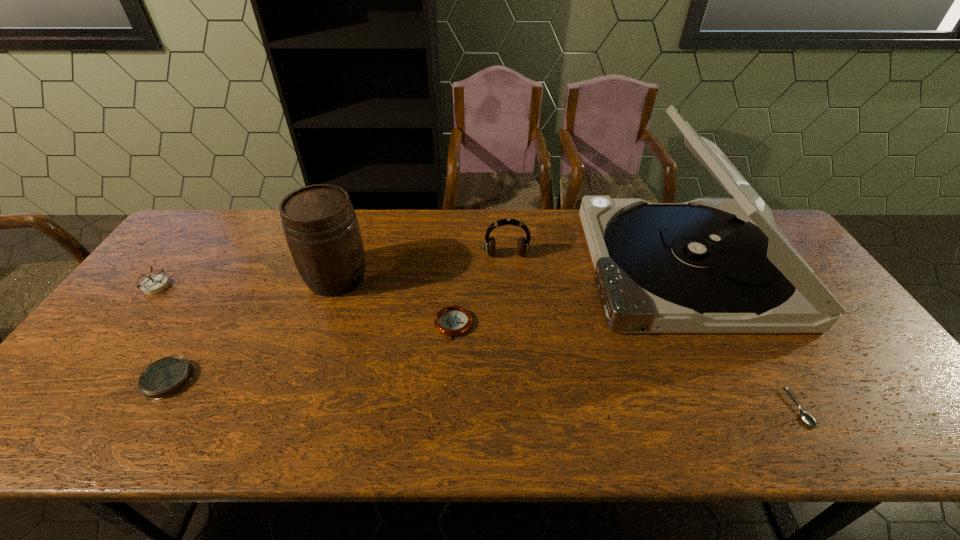
The width and height of the screenshot is (960, 540). In order to click on unoccupied area between the second object from left to right and the second farthest compass in this screenshot , I will do click(x=311, y=352).

Locate an element on the screen. object that is the fifth closest one to the tallest object is located at coordinates (167, 376).

Identify which object is the second closest to the soupspoon. Please provide its 2D coordinates. Your answer should be formatted as a tuple, i.e. [(x, y)], where the tuple contains the x and y coordinates of a point satisfying the conditions above.

[(523, 244)]

At what (x,y) coordinates should I click in order to perform the action: click on compass that stands as the second closest to the CD player. Please return your answer as a coordinate pair (x, y). Image resolution: width=960 pixels, height=540 pixels. Looking at the image, I should click on point(167,376).

I want to click on compass that is the third closest to the tallest object, so click(x=155, y=284).

Image resolution: width=960 pixels, height=540 pixels. What are the coordinates of `blank area in the image that satisfies the following two spatial constraints: 1. on the side of the fourth object from left to right near the bung hole; 2. on the right side of the cider` in the screenshot? It's located at (320, 326).

Find the location of `vacant space that satisfies the following two spatial constraints: 1. on the control panel of the tallest object; 2. on the right side of the shortest object`. vacant space that satisfies the following two spatial constraints: 1. on the control panel of the tallest object; 2. on the right side of the shortest object is located at coordinates (756, 408).